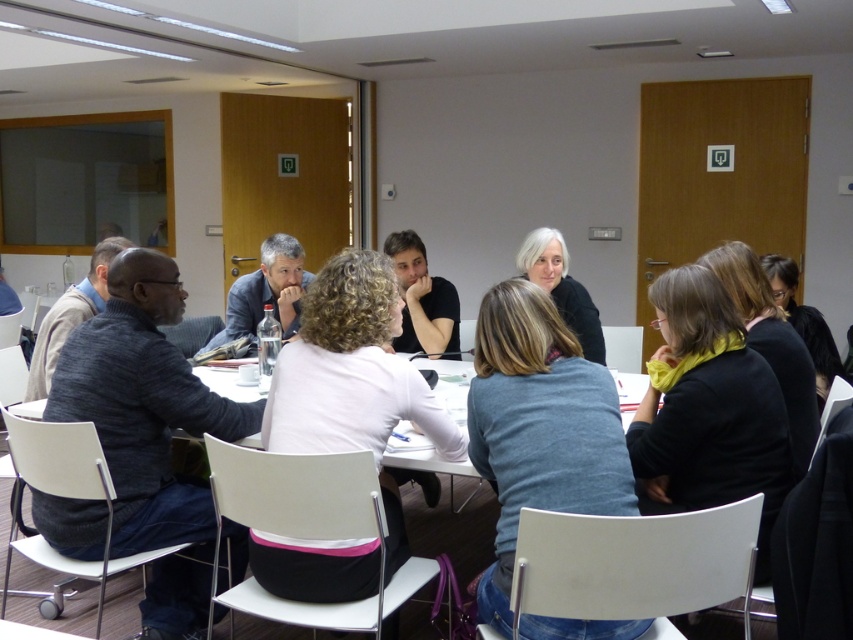
Question: Which point appears closest to the camera in this image?

Choices:
 (A) (300, 596)
 (B) (88, 525)

Answer: (A)

Question: Does dark gray sweater at left appear on the right side of light pink fabric shirt at center?

Choices:
 (A) no
 (B) yes

Answer: (A)

Question: Is dark gray sweater at left smaller than light pink fabric shirt at center?

Choices:
 (A) no
 (B) yes

Answer: (B)

Question: Among these objects, which one is farthest from the camera?

Choices:
 (A) dark gray sweater at left
 (B) light pink fabric shirt at center

Answer: (A)

Question: Does dark gray sweater at left come in front of light pink fabric shirt at center?

Choices:
 (A) yes
 (B) no

Answer: (B)

Question: Which object appears farthest from the camera in this image?

Choices:
 (A) dark gray sweater at left
 (B) light pink fabric shirt at center

Answer: (A)